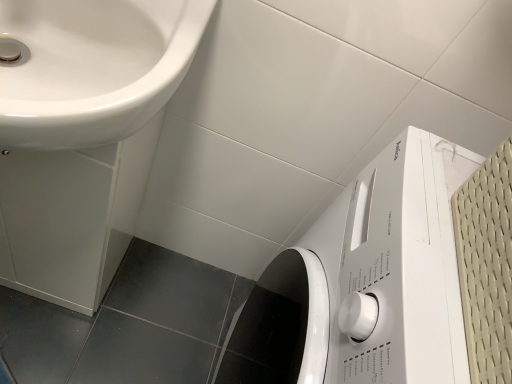
Question: Considering the positions of white glossy washing machine at lower right and white glossy sink at upper left in the image, is white glossy washing machine at lower right bigger or smaller than white glossy sink at upper left?

Choices:
 (A) big
 (B) small

Answer: (A)

Question: Is point (420, 165) closer or farther from the camera than point (176, 76)?

Choices:
 (A) farther
 (B) closer

Answer: (A)

Question: Choose the correct answer: Is white glossy washing machine at lower right inside white glossy sink at upper left or outside it?

Choices:
 (A) inside
 (B) outside

Answer: (B)

Question: Is white glossy sink at upper left to the left or to the right of white glossy washing machine at lower right in the image?

Choices:
 (A) left
 (B) right

Answer: (A)

Question: Is white glossy sink at upper left wider or thinner than white glossy washing machine at lower right?

Choices:
 (A) wide
 (B) thin

Answer: (B)

Question: Is point (110, 84) closer or farther from the camera than point (414, 256)?

Choices:
 (A) farther
 (B) closer

Answer: (A)

Question: From the image's perspective, is white glossy sink at upper left positioned above or below white glossy washing machine at lower right?

Choices:
 (A) above
 (B) below

Answer: (A)